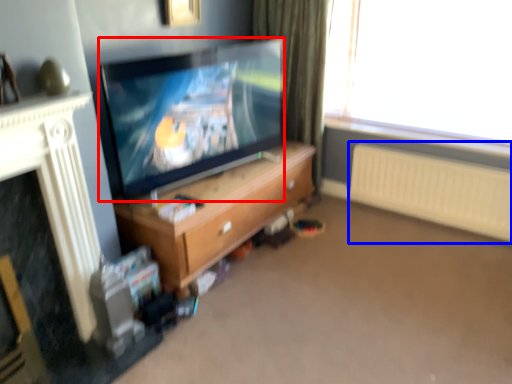
Question: Which point is further to the camera, television (highlighted by a red box) or radiator (highlighted by a blue box)?

Choices:
 (A) television
 (B) radiator

Answer: (B)